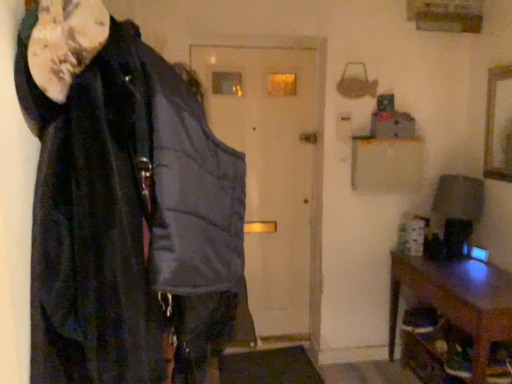
This screenshot has width=512, height=384. What do you see at coordinates (457, 300) in the screenshot?
I see `brown wooden table at lower right` at bounding box center [457, 300].

This screenshot has height=384, width=512. Identify the location of brown wooden table at lower right. (457, 300).

Can you confirm if brown wooden table at lower right is smaller than velvet black cloak at left?

Indeed, brown wooden table at lower right has a smaller size compared to velvet black cloak at left.

Considering the points (510, 307) and (141, 142), which point is in front, point (510, 307) or point (141, 142)?

The point (141, 142) is more forward.

Locate an element on the screen. cloak to the left of brown wooden table at lower right is located at coordinates (125, 207).

Would you consider velvet black cloak at left to be distant from wooden picture frame at upper right?

Yes, velvet black cloak at left and wooden picture frame at upper right are located far from each other.

Is point (115, 352) positioned behind point (509, 145)?

No, it is in front of (509, 145).

Which object is positioned more to the right, velvet black cloak at left or wooden picture frame at upper right?

Positioned to the right is wooden picture frame at upper right.

From a real-world perspective, is velvet black cloak at left positioned above or below wooden picture frame at upper right?

velvet black cloak at left is below wooden picture frame at upper right.

Does point (489, 109) lie in front of point (495, 274)?

No, it is not.

From a real-world perspective, is wooden picture frame at upper right beneath brown wooden table at lower right?

Incorrect, from a real-world perspective, wooden picture frame at upper right is higher than brown wooden table at lower right.

From the image's perspective, between wooden picture frame at upper right and brown wooden table at lower right, who is located below?

brown wooden table at lower right is shown below in the image.

Is brown wooden table at lower right located within wooden picture frame at upper right?

No.

Is wooden picture frame at upper right taller or shorter than velvet black cloak at left?

wooden picture frame at upper right is shorter than velvet black cloak at left.

Considering the sizes of objects wooden picture frame at upper right and velvet black cloak at left in the image provided, who is bigger, wooden picture frame at upper right or velvet black cloak at left?

velvet black cloak at left.

Would you consider wooden picture frame at upper right to be distant from velvet black cloak at left?

That's right, there is a large distance between wooden picture frame at upper right and velvet black cloak at left.

Is matte gray vest at center to the right of wooden picture frame at upper right from the viewer's perspective?

No.

From a real-world perspective, is matte gray vest at center physically below wooden picture frame at upper right?

Yes, from a real-world perspective, matte gray vest at center is beneath wooden picture frame at upper right.

Does matte gray vest at center have a lesser height compared to wooden picture frame at upper right?

No.

Image resolution: width=512 pixels, height=384 pixels. I want to click on door behind the brown wooden table at lower right, so click(x=270, y=168).

Is matte gray vest at center directly adjacent to brown wooden table at lower right?

matte gray vest at center and brown wooden table at lower right are not in contact.

From a real-world perspective, is matte gray vest at center physically located above or below brown wooden table at lower right?

From a real-world perspective, matte gray vest at center is physically above brown wooden table at lower right.

Is matte gray vest at center further to camera compared to brown wooden table at lower right?

Yes, it is behind brown wooden table at lower right.

How much distance is there between matte gray vest at center and velvet black cloak at left?

matte gray vest at center and velvet black cloak at left are 1.76 meters apart from each other.

Can you tell me how much matte gray vest at center and velvet black cloak at left differ in facing direction?

The angle between the facing direction of matte gray vest at center and the facing direction of velvet black cloak at left is 89.9 degrees.

Is matte gray vest at center thinner than velvet black cloak at left?

Correct, the width of matte gray vest at center is less than that of velvet black cloak at left.

Consider the image. Can you confirm if matte gray vest at center is bigger than velvet black cloak at left?

Actually, matte gray vest at center might be smaller than velvet black cloak at left.

At what (x,y) coordinates should I click in order to perform the action: click on furniture below the velvet black cloak at left (from a real-world perspective). Please return your answer as a coordinate pair (x, y). The height and width of the screenshot is (384, 512). Looking at the image, I should click on [x=457, y=300].

Where is `picture frame above the velvet black cloak at left (from a real-world perspective)`? The height and width of the screenshot is (384, 512). picture frame above the velvet black cloak at left (from a real-world perspective) is located at coordinates (498, 124).

Estimate the real-world distances between objects in this image. Which object is further from matte gray vest at center, velvet black cloak at left or wooden picture frame at upper right?

Among the two, velvet black cloak at left is located further to matte gray vest at center.

Consider the image. Estimate the real-world distances between objects in this image. Which object is closer to brown wooden table at lower right, wooden picture frame at upper right or velvet black cloak at left?

wooden picture frame at upper right lies closer to brown wooden table at lower right than the other object.

Looking at the image, which one is located further to velvet black cloak at left, matte gray vest at center or brown wooden table at lower right?

Based on the image, matte gray vest at center appears to be further to velvet black cloak at left.

Which object lies nearer to the anchor point brown wooden table at lower right, matte gray vest at center or wooden picture frame at upper right?

wooden picture frame at upper right lies closer to brown wooden table at lower right than the other object.

From the image, which object appears to be farther from velvet black cloak at left, wooden picture frame at upper right or brown wooden table at lower right?

wooden picture frame at upper right.

Based on their spatial positions, is brown wooden table at lower right or matte gray vest at center further from velvet black cloak at left?

matte gray vest at center lies further to velvet black cloak at left than the other object.

Estimate the real-world distances between objects in this image. Which object is further from matte gray vest at center, wooden picture frame at upper right or brown wooden table at lower right?

wooden picture frame at upper right.

Looking at the image, which one is located closer to wooden picture frame at upper right, matte gray vest at center or velvet black cloak at left?

Among the two, matte gray vest at center is located nearer to wooden picture frame at upper right.

Locate an element on the screen. This screenshot has height=384, width=512. furniture between matte gray vest at center and wooden picture frame at upper right in the horizontal direction is located at coordinates (457, 300).

I want to click on picture frame positioned between velvet black cloak at left and matte gray vest at center from near to far, so click(x=498, y=124).

Image resolution: width=512 pixels, height=384 pixels. Identify the location of furniture located between velvet black cloak at left and wooden picture frame at upper right in the left-right direction. (457, 300).

I want to click on furniture between velvet black cloak at left and matte gray vest at center from front to back, so click(457, 300).